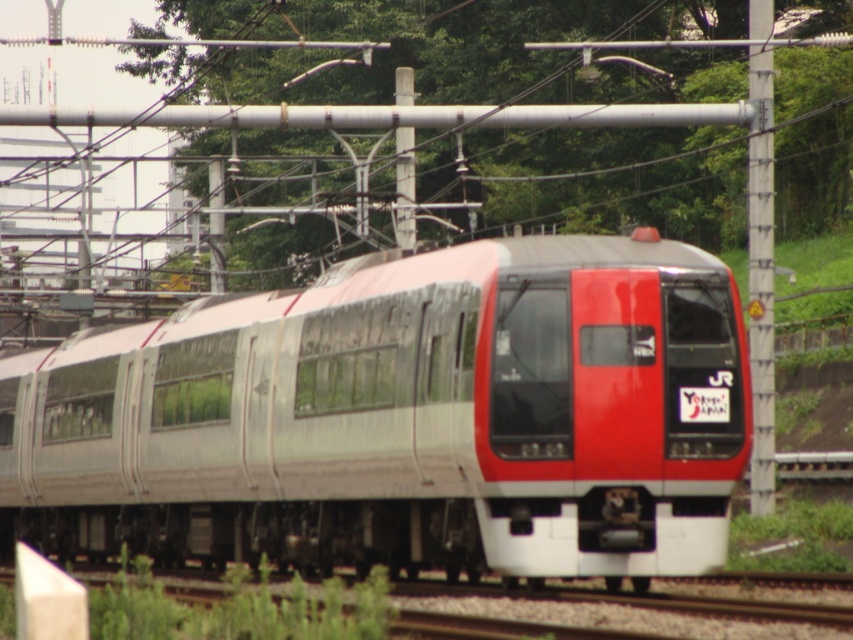
Is point (767, 340) behind point (415, 221)?

That is False.

Does metallic gray pole at right come behind metallic gray pole at center?

No, it is in front of metallic gray pole at center.

Who is more distant from viewer, (764, 276) or (413, 243)?

The point (413, 243) is behind.

At what (x,y) coordinates should I click in order to perform the action: click on metallic gray pole at right. Please return your answer as a coordinate pair (x, y). This screenshot has height=640, width=853. Looking at the image, I should click on (759, 253).

Who is higher up, silver metallic train at center or metallic gray pole at right?

metallic gray pole at right is higher up.

What do you see at coordinates (402, 419) in the screenshot? Image resolution: width=853 pixels, height=640 pixels. I see `silver metallic train at center` at bounding box center [402, 419].

The height and width of the screenshot is (640, 853). In order to click on silver metallic train at center in this screenshot , I will do `click(402, 419)`.

Does silver metallic train at center have a greater width compared to metallic gray pole at center?

Indeed, silver metallic train at center has a greater width compared to metallic gray pole at center.

Can you confirm if silver metallic train at center is smaller than metallic gray pole at center?

Incorrect, silver metallic train at center is not smaller in size than metallic gray pole at center.

Does point (90, 392) come farther from viewer compared to point (397, 225)?

No, (90, 392) is closer to viewer.

This screenshot has width=853, height=640. In order to click on silver metallic train at center in this screenshot , I will do `click(402, 419)`.